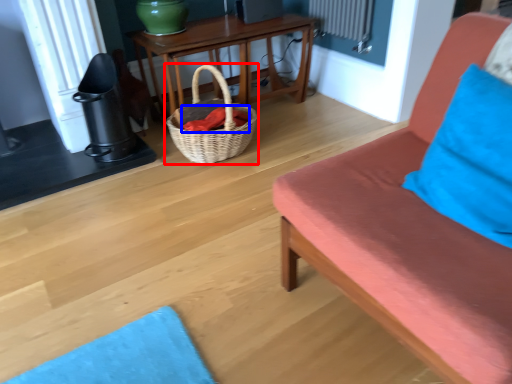
Question: Among these objects, which one is nearest to the camera, picnic basket (highlighted by a red box) or material (highlighted by a blue box)?

Choices:
 (A) picnic basket
 (B) material

Answer: (A)